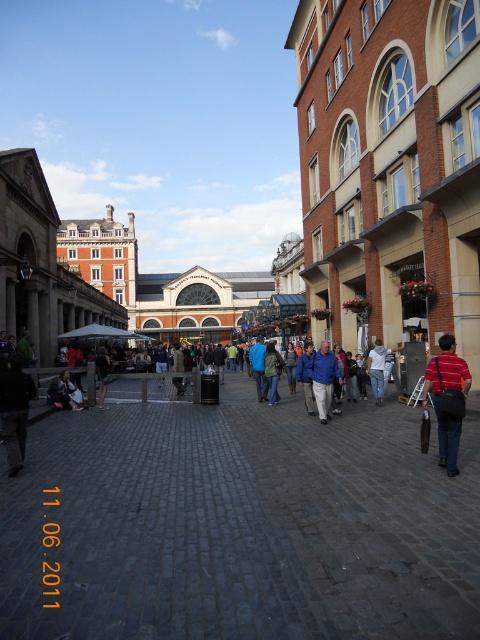
Measure the distance from striped cotton shirt at lower right to blue fleece jacket at center.

A distance of 52.47 feet exists between striped cotton shirt at lower right and blue fleece jacket at center.

Based on the photo, can you confirm if striped cotton shirt at lower right is positioned above blue fleece jacket at center?

Indeed, striped cotton shirt at lower right is positioned over blue fleece jacket at center.

Between point (455, 388) and point (321, 392), which one is positioned in front?

Point (455, 388) is more forward.

Image resolution: width=480 pixels, height=640 pixels. Identify the location of striped cotton shirt at lower right. (447, 397).